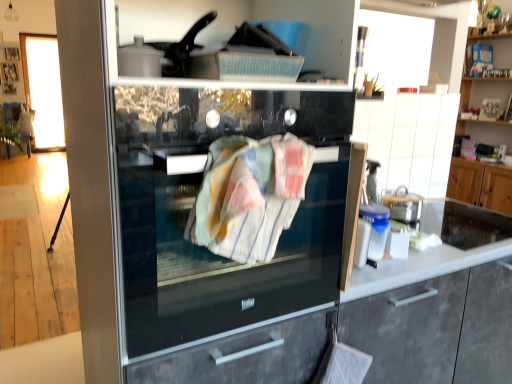
Question: Do you think white tile cabinetry at upper right, the second cabinetry from the back, is within white glossy countertop at right, or outside of it?

Choices:
 (A) inside
 (B) outside

Answer: (B)

Question: Is white tile cabinetry at upper right, the 3th cabinetry from the right, taller or shorter than white glossy countertop at right?

Choices:
 (A) short
 (B) tall

Answer: (B)

Question: Which of these objects is positioned farthest from the white glossy countertop at right?

Choices:
 (A) white tile cabinetry at upper right, positioned as the second cabinetry in front-to-back order
 (B) striped cotton towel at center
 (C) matte gray cabinet at center, arranged as the first cabinetry when viewed from the front
 (D) wooden cabinet at upper right, marked as the first cabinetry in a right-to-left arrangement
 (E) black glass fridge at center

Answer: (D)

Question: Based on their relative distances, which object is nearer to the wooden cabinet at upper right, acting as the 1th cabinetry starting from the back?

Choices:
 (A) black glass fridge at center
 (B) matte gray cabinet at center, arranged as the first cabinetry when viewed from the front
 (C) striped cotton towel at center
 (D) white tile cabinetry at upper right, the second cabinetry from the back
 (E) white glossy countertop at right

Answer: (D)